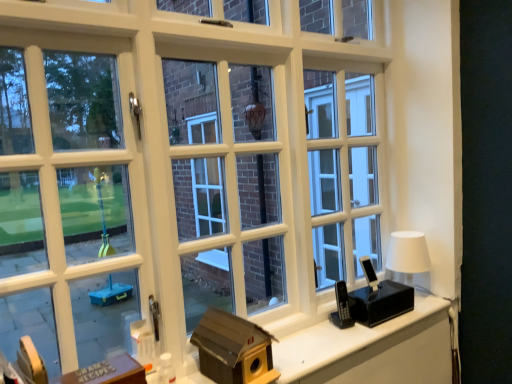
The height and width of the screenshot is (384, 512). In order to click on free space above metallic silver buttons at lower left (from a real-world perspective) in this screenshot , I will do `click(101, 372)`.